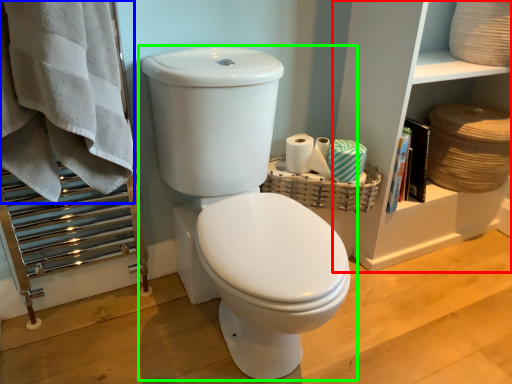
Question: Based on their relative distances, which object is farther from shelf (highlighted by a red box)? Choose from bath towel (highlighted by a blue box) and toilet (highlighted by a green box).

Choices:
 (A) bath towel
 (B) toilet

Answer: (A)